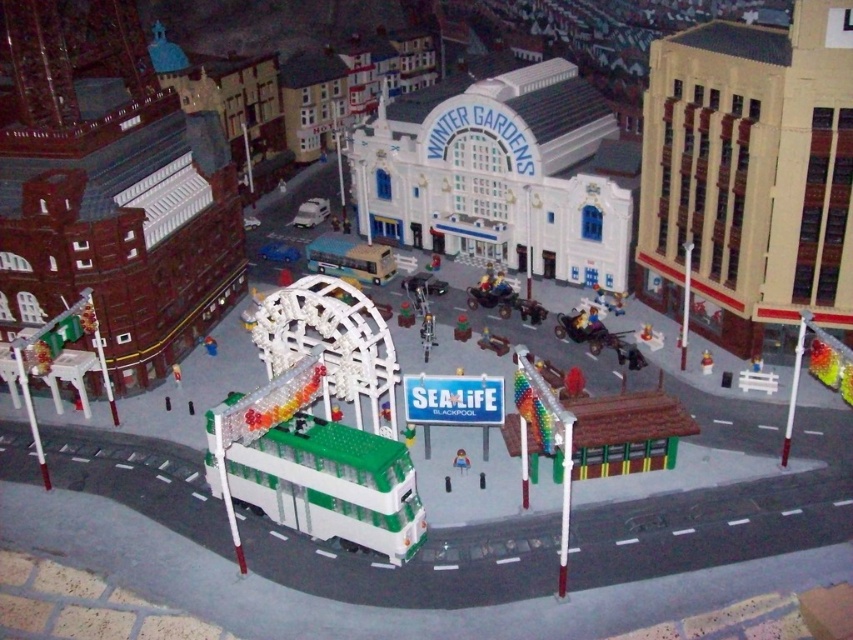
Is metallic silver cart at center positioned behind green plastic bus at center?

No, it is not.

Is metallic silver cart at center shorter than green plastic bus at center?

Incorrect, metallic silver cart at center's height does not fall short of green plastic bus at center's.

Between point (605, 346) and point (480, 342), which one is positioned behind?

Positioned behind is point (480, 342).

Where is `metallic silver cart at center`? metallic silver cart at center is located at coordinates (596, 336).

Does light brown plastic bus at center have a lesser width compared to green plastic quad bike at center?

Correct, light brown plastic bus at center's width is less than green plastic quad bike at center's.

Based on the photo, does light brown plastic bus at center have a greater height compared to green plastic quad bike at center?

No.

Is point (390, 259) farther from camera compared to point (466, 296)?

Yes, it is behind point (466, 296).

At what (x,y) coordinates should I click in order to perform the action: click on light brown plastic bus at center. Please return your answer as a coordinate pair (x, y). Looking at the image, I should click on (350, 259).

Does light brown plastic bus at center appear on the left side of green plastic toy at center?

Correct, you'll find light brown plastic bus at center to the left of green plastic toy at center.

Is light brown plastic bus at center above green plastic toy at center?

Correct, light brown plastic bus at center is located above green plastic toy at center.

Does point (317, 262) come behind point (469, 332)?

Yes, point (317, 262) is behind point (469, 332).

This screenshot has width=853, height=640. What are the coordinates of `light brown plastic bus at center` in the screenshot? It's located at (350, 259).